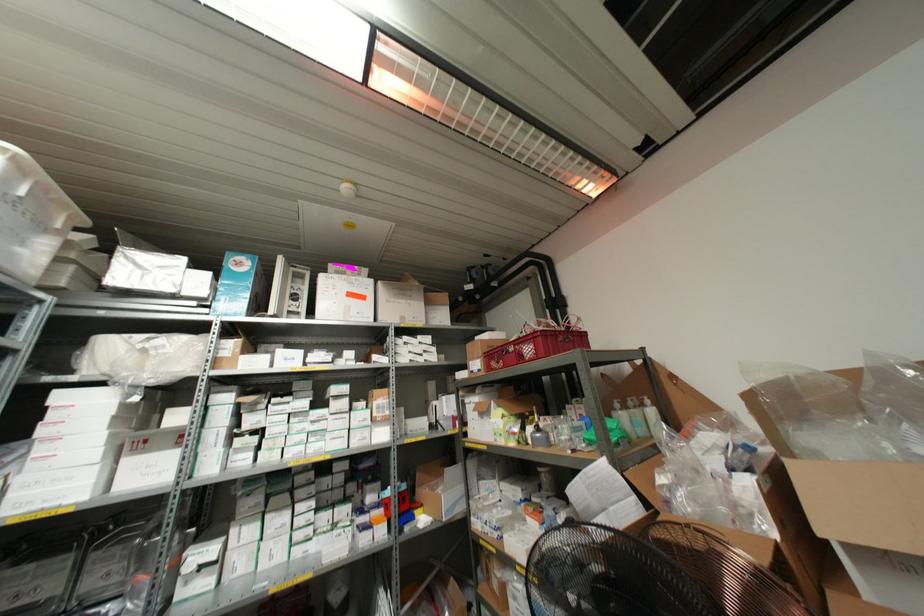
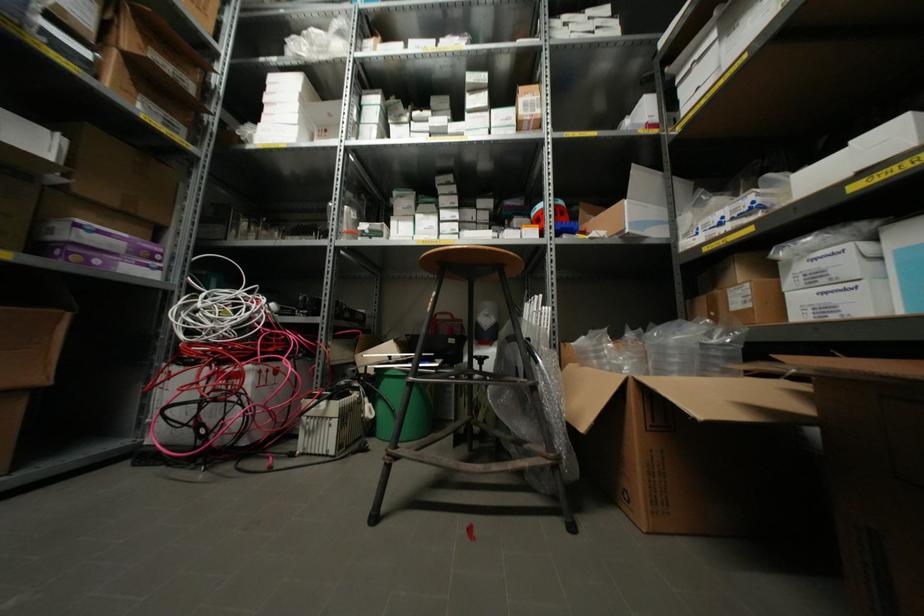
Where in the second image is the point corresponding to pixel 373 414 from the first image?

(519, 111)